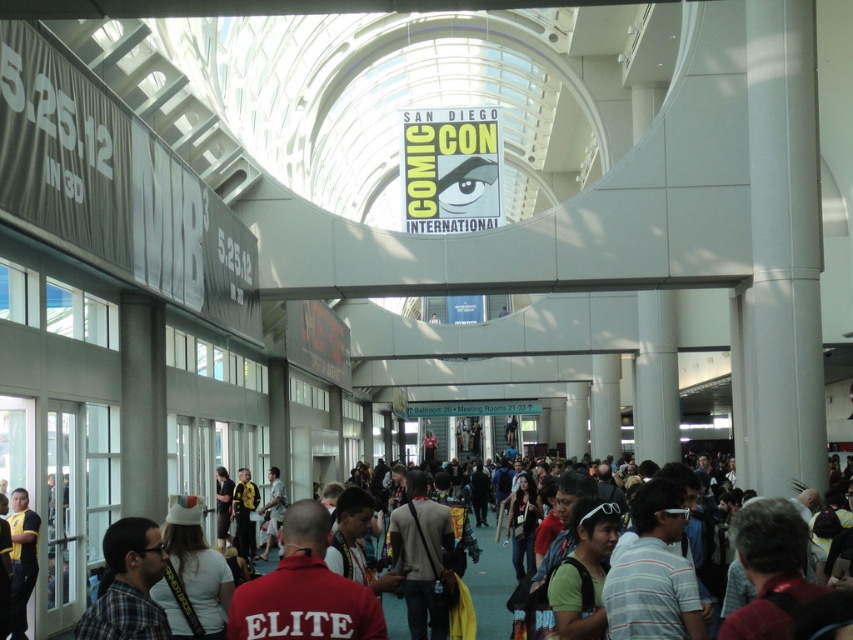
Question: Can you confirm if multicolored fabric crowd at center is smaller than yellow jersey at center?

Choices:
 (A) no
 (B) yes

Answer: (A)

Question: Does multicolored fabric crowd at center have a smaller size compared to yellow jersey at center?

Choices:
 (A) yes
 (B) no

Answer: (B)

Question: Which point is closer to the camera?

Choices:
 (A) plaid shirt at lower left
 (B) multicolored fabric crowd at center
 (C) yellow jersey at center

Answer: (A)

Question: Which of the following is the closest to the observer?

Choices:
 (A) multicolored fabric crowd at center
 (B) yellow jersey at center
 (C) plaid shirt at lower left

Answer: (C)

Question: Which point is farther from the camera taking this photo?

Choices:
 (A) (22, 566)
 (B) (97, 628)
 (C) (502, 596)

Answer: (C)

Question: Observing the image, what is the correct spatial positioning of multicolored fabric crowd at center in reference to yellow jersey at center?

Choices:
 (A) below
 (B) above

Answer: (A)